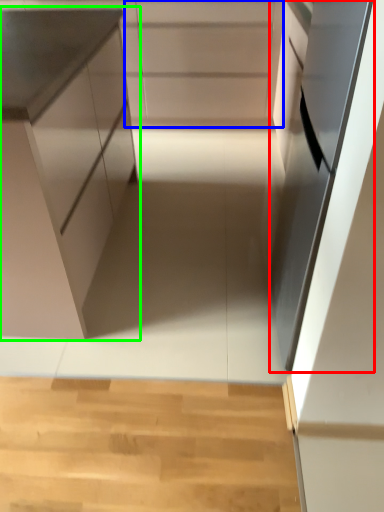
Question: Considering the real-world distances, which object is closest to oven (highlighted by a red box)? cabinetry (highlighted by a blue box) or cabinetry (highlighted by a green box).

Choices:
 (A) cabinetry
 (B) cabinetry

Answer: (B)